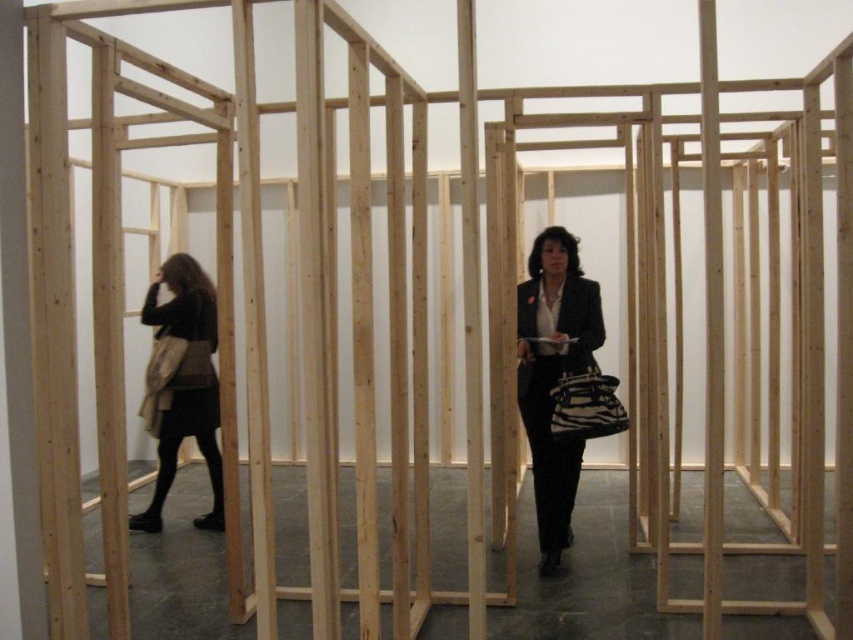
You are standing in front of the structure made of light wooden beams and want to pick up the matte black blazer at center and the matte black coat at left. Which one do you need to reach out further to grab?

The matte black coat at left is further away from you than the matte black blazer at center, so you need to reach out further to grab the matte black coat at left.

You are a fashion designer observing an art installation. You notice the matte black blazer at center and the matte black coat at left. Which item has a narrower width?

The matte black blazer at center has a narrower width than the matte black coat at left.

You are standing at the entrance of the structure made of light wooden beams. You notice two points marked on the floor at coordinates point (541,416) and point (158,452). Which point is closer to you when you first enter?

Point (541,416) is in front of point (158,452), so the point closer to you when you first enter is point (541,416).